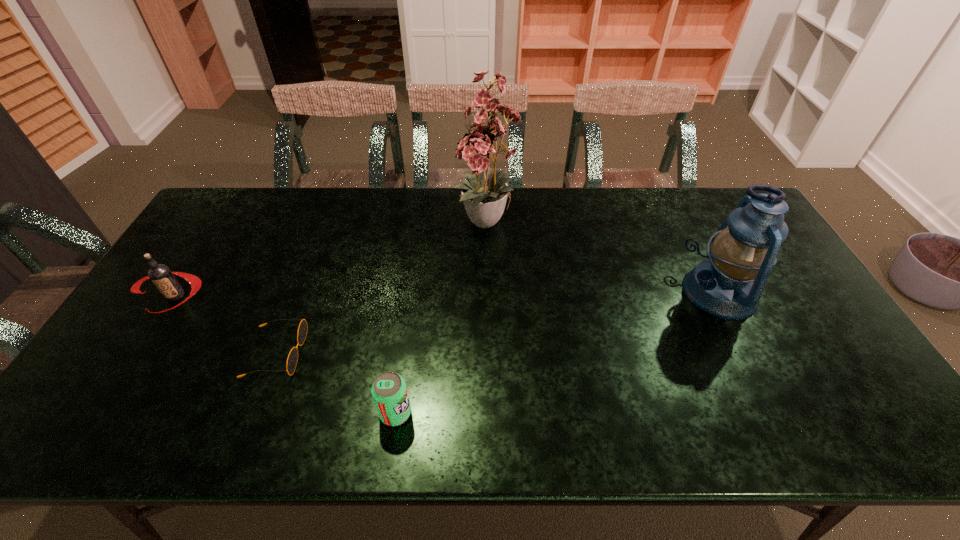
Where is `the second object from right to left`? This screenshot has width=960, height=540. the second object from right to left is located at coordinates (484, 196).

Identify the location of flower arrangement. (484, 196).

Locate an element on the screen. The width and height of the screenshot is (960, 540). lantern is located at coordinates (728, 285).

This screenshot has height=540, width=960. Identify the location of the fourth shortest object. (728, 285).

Where is `the leftmost object`? The width and height of the screenshot is (960, 540). the leftmost object is located at coordinates (162, 277).

This screenshot has height=540, width=960. Find the location of `the third tallest object`. the third tallest object is located at coordinates (162, 277).

Where is `the second shortest object`? the second shortest object is located at coordinates (389, 391).

This screenshot has width=960, height=540. In order to click on the third object from right to left in this screenshot , I will do `click(389, 391)`.

The width and height of the screenshot is (960, 540). What are the coordinates of `the shortest object` in the screenshot? It's located at (292, 359).

The width and height of the screenshot is (960, 540). Identify the location of the fourth object from right to left. (292, 359).